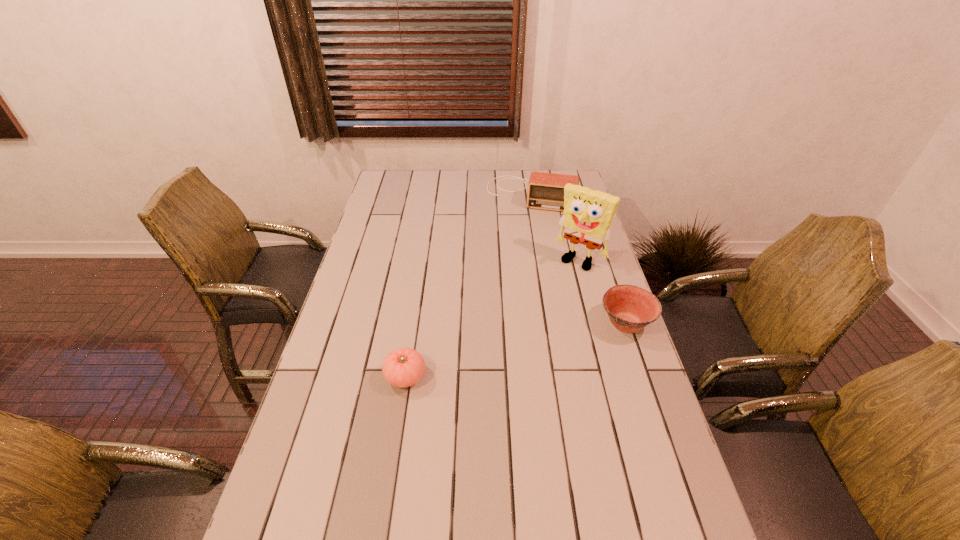
What are the coordinates of `free area in between the farthest object and the second nearest object` in the screenshot? It's located at coord(578,259).

I want to click on free space between the third farthest object and the third shortest object, so click(578, 259).

Where is `free space between the farthest object and the third farthest object`? This screenshot has width=960, height=540. free space between the farthest object and the third farthest object is located at coordinates (578, 259).

Find the location of a particular element. Image resolution: width=960 pixels, height=540 pixels. unoccupied area between the bowl and the tallest object is located at coordinates (603, 292).

Identify the location of empty space that is in between the sponge and the second nearest object. The image size is (960, 540). (603, 292).

Locate an element on the screen. free spot between the tallest object and the third shortest object is located at coordinates (555, 227).

The image size is (960, 540). I want to click on object that is the closest to the third farthest object, so click(x=588, y=214).

Identify which object is the third nearest to the bowl. Please provide its 2D coordinates. Your answer should be formatted as a tuple, i.e. [(x, y)], where the tuple contains the x and y coordinates of a point satisfying the conditions above.

[(545, 190)]

I want to click on free region that satisfies the following two spatial constraints: 1. on the front side of the radio receiver; 2. on the left side of the third farthest object, so click(x=552, y=323).

Image resolution: width=960 pixels, height=540 pixels. I want to click on free point that satisfies the following two spatial constraints: 1. on the back side of the nearest object; 2. on the left side of the bowl, so click(414, 323).